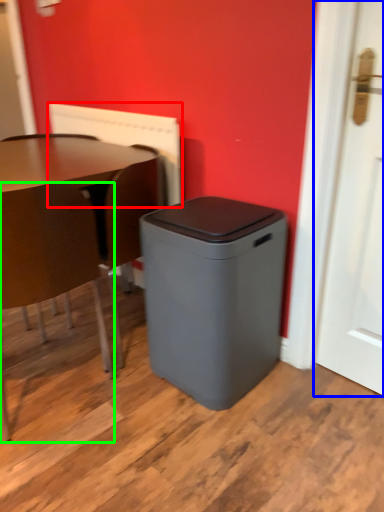
Question: Which is farther away from radiator (highlighted by a red box)? door (highlighted by a blue box) or chair (highlighted by a green box)?

Choices:
 (A) door
 (B) chair

Answer: (A)